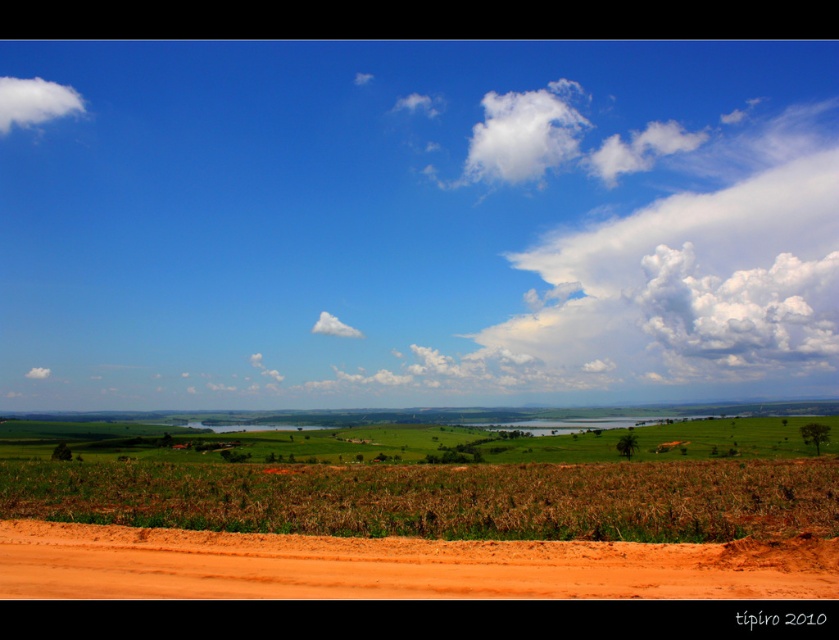
Question: Estimate the real-world distances between objects in this image. Which object is closer to the white fluffy cloud at upper left?

Choices:
 (A) white fluffy cloud at upper center
 (B) white fluffy cloud at center
 (C) dusty orange dirt at bottom

Answer: (A)

Question: Can you confirm if white fluffy cloud at upper left is positioned to the left of white fluffy cloud at center?

Choices:
 (A) yes
 (B) no

Answer: (A)

Question: Which point appears farthest from the camera in this image?

Choices:
 (A) (348, 324)
 (B) (23, 92)
 (C) (73, 576)

Answer: (B)

Question: In this image, where is white fluffy cloud at upper left located relative to white fluffy cloud at upper center?

Choices:
 (A) left
 (B) right

Answer: (A)

Question: Is dusty orange dirt at bottom bigger than white fluffy cloud at upper center?

Choices:
 (A) yes
 (B) no

Answer: (B)

Question: Which point is closer to the camera?

Choices:
 (A) (334, 321)
 (B) (292, 548)

Answer: (B)